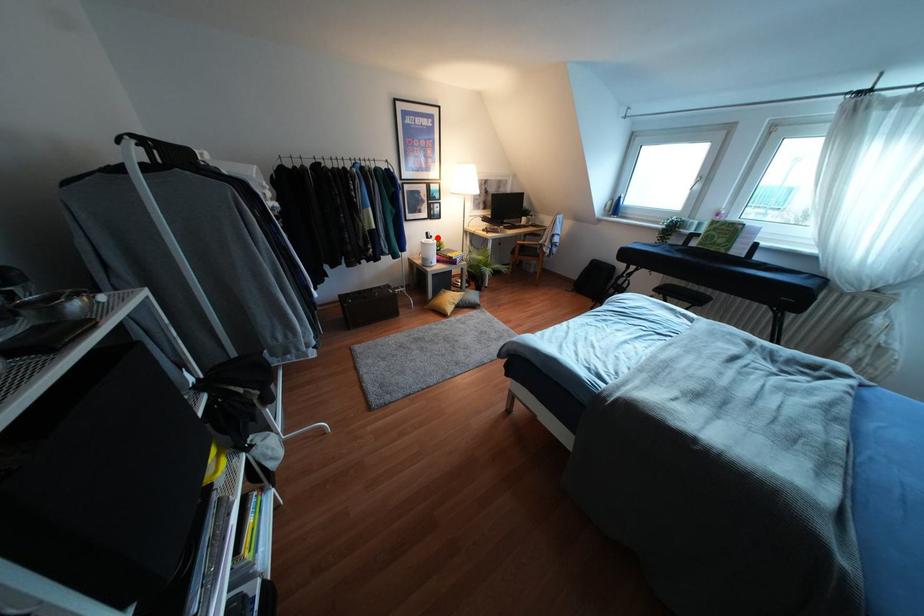
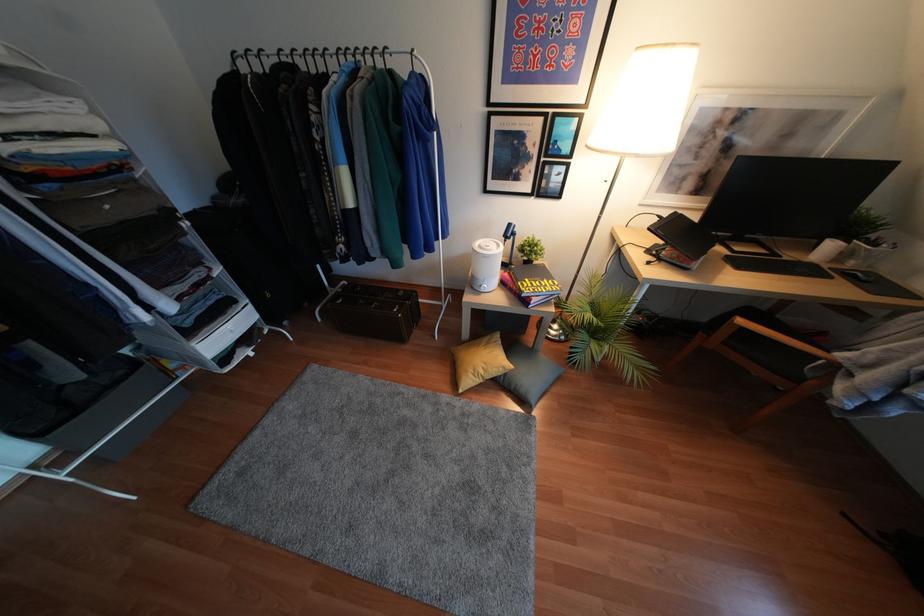
Question: I am providing you with two images of the same scene from different viewpoints. In image1, a red point is highlighted. Considering the same 3D point in image2, which of the following is correct?

Choices:
 (A) It is closer
 (B) It is farther

Answer: (A)